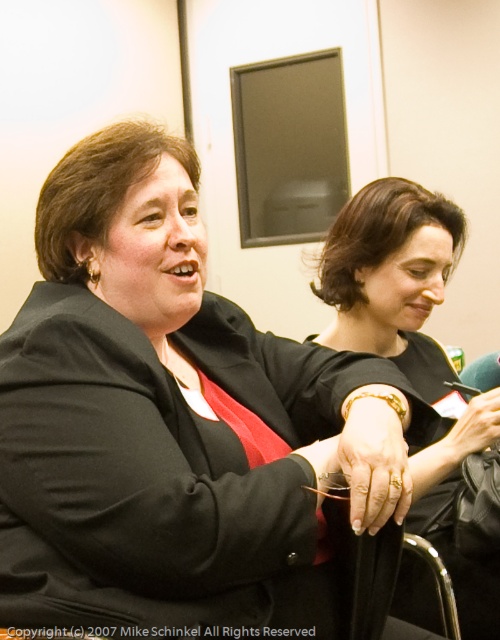
Question: Among these points, which one is nearest to the camera?

Choices:
 (A) (431, 276)
 (B) (417, 552)

Answer: (B)

Question: Considering the relative positions of black matte dress at center and metallic silver chair at lower right in the image provided, where is black matte dress at center located with respect to metallic silver chair at lower right?

Choices:
 (A) left
 (B) right

Answer: (B)

Question: Is black matte dress at center positioned before metallic silver chair at lower right?

Choices:
 (A) yes
 (B) no

Answer: (B)

Question: Can you confirm if black matte dress at center is bigger than metallic silver chair at lower right?

Choices:
 (A) no
 (B) yes

Answer: (B)